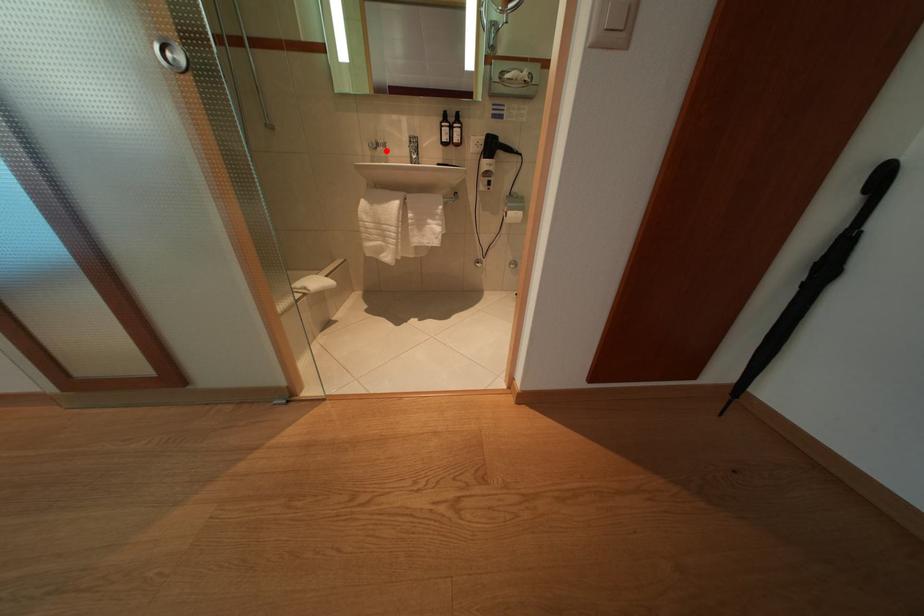
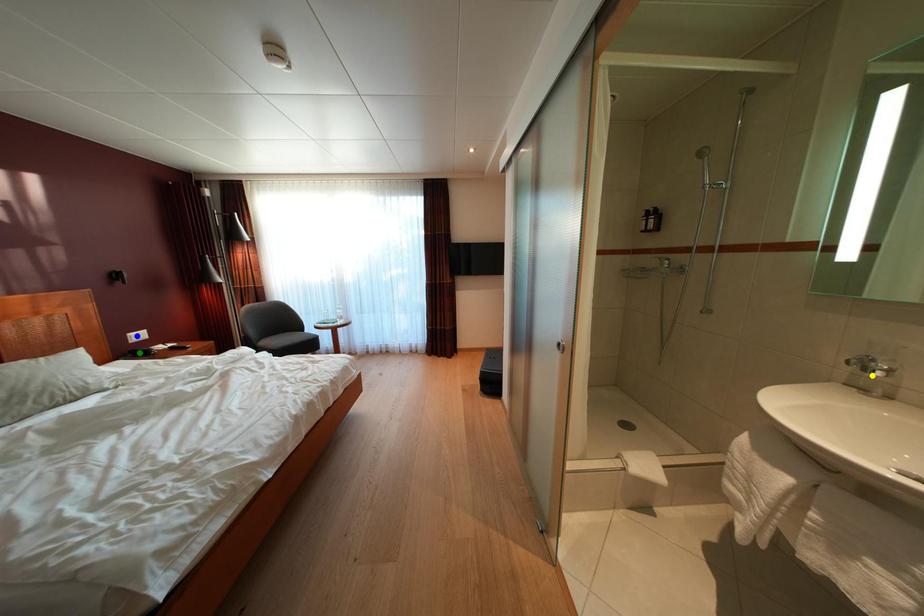
Question: I am providing you with two images of the same scene from different viewpoints. A red point is marked on the first image. You are given multiple points on the second image. Which mark in image 2 goes with the point in image 1?

Choices:
 (A) green point
 (B) blue point
 (C) yellow point

Answer: (C)